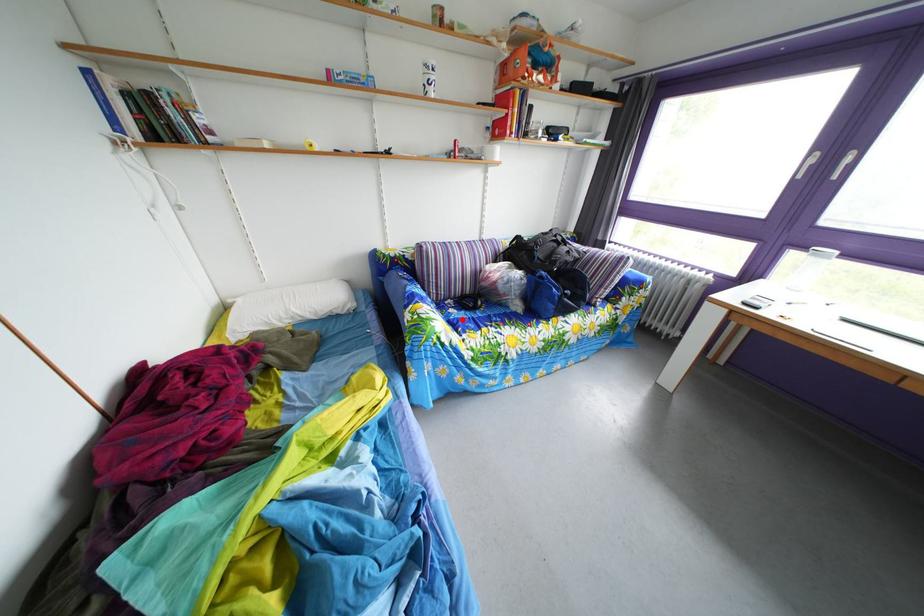
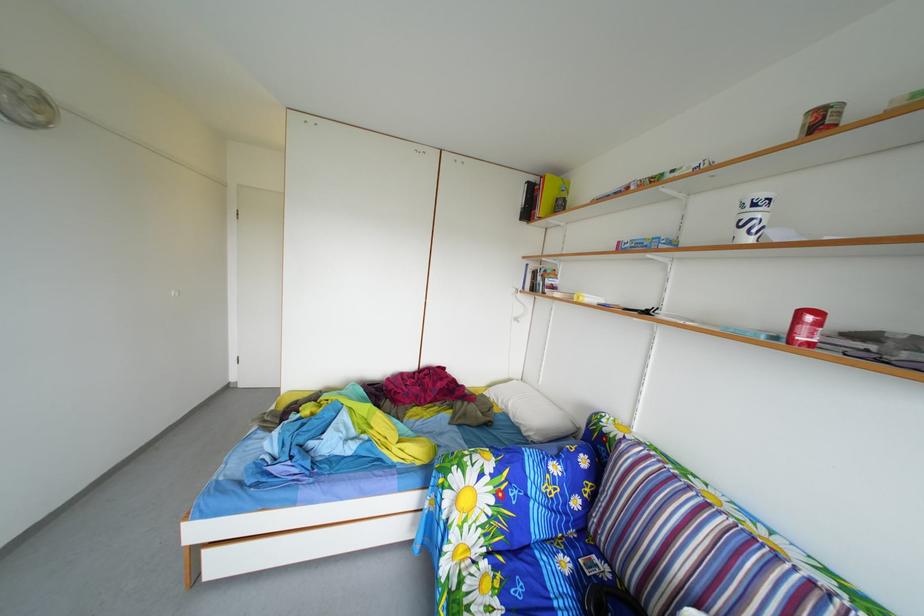
Question: I am providing you with two images of the same scene from different viewpoints. A red point is marked on the first image. Can you still see the location of the red point in image 2?

Choices:
 (A) Yes
 (B) No

Answer: (A)